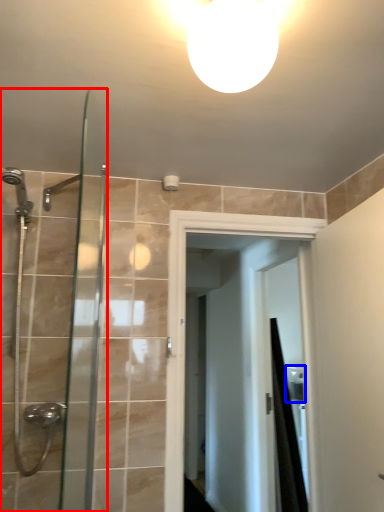
Question: Among these objects, which one is nearest to the camera, shower door (highlighted by a red box) or sink (highlighted by a blue box)?

Choices:
 (A) shower door
 (B) sink

Answer: (A)